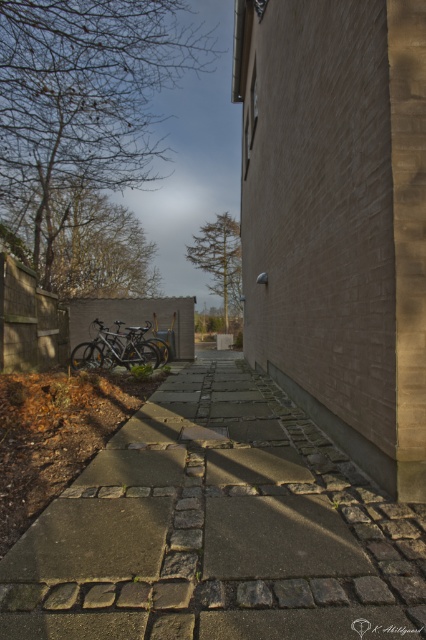
Between stone paved walkway at center and shiny metallic bicycle at center, which one has more height?

shiny metallic bicycle at center

Does stone paved walkway at center appear over shiny metallic bicycle at center?

No.

Between point (264, 538) and point (95, 362), which one is positioned in front?

Point (264, 538) is more forward.

Where is `stone paved walkway at center`? The image size is (426, 640). stone paved walkway at center is located at coordinates (216, 529).